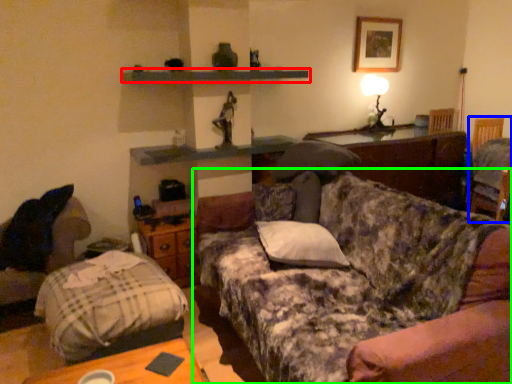
Question: Considering the real-world distances, which object is closest to shelf (highlighted by a red box)? swivel chair (highlighted by a blue box) or studio couch (highlighted by a green box).

Choices:
 (A) swivel chair
 (B) studio couch

Answer: (B)